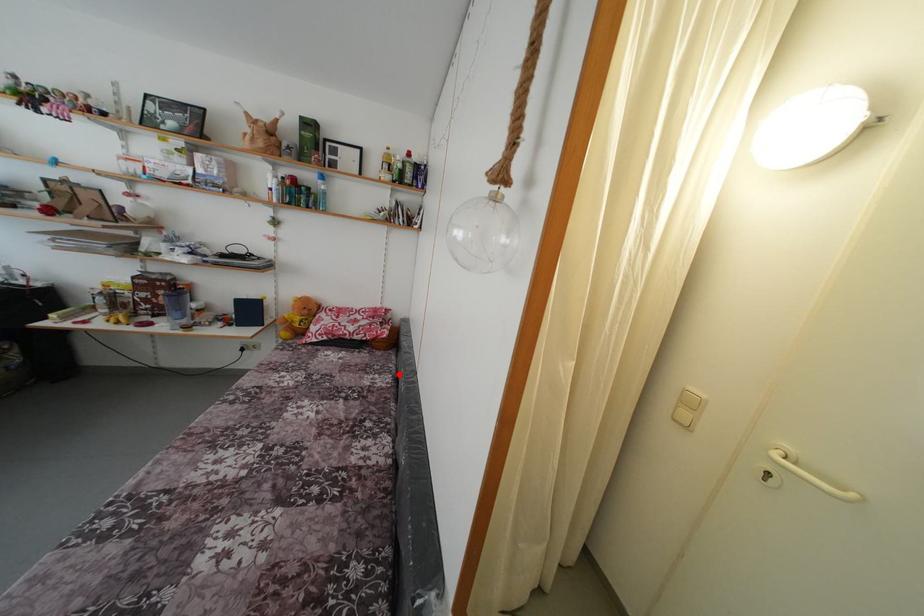
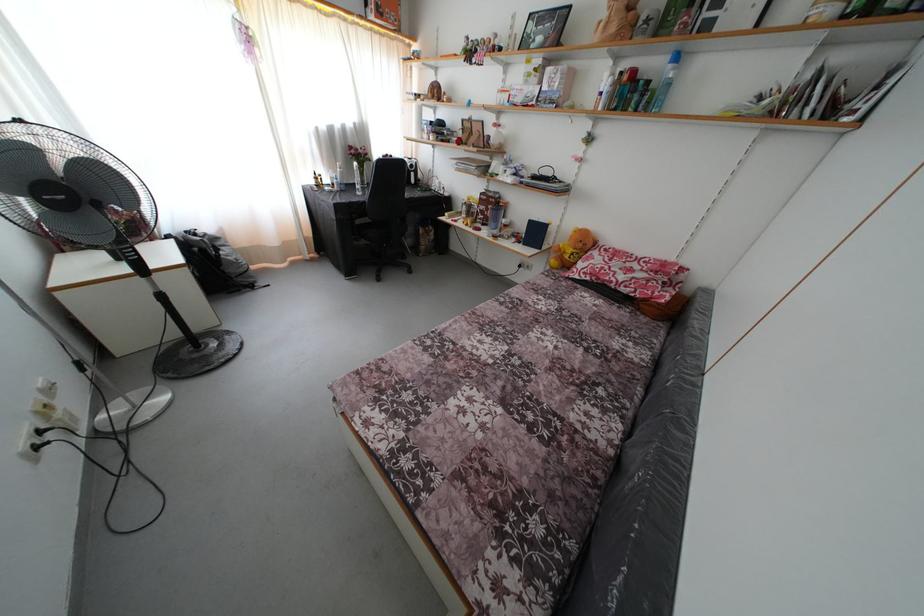
Question: I am providing you with two images of the same scene from different viewpoints. In image1, a red point is highlighted. Considering the same 3D point in image2, which of the following is correct?

Choices:
 (A) It is closer
 (B) It is farther

Answer: (A)